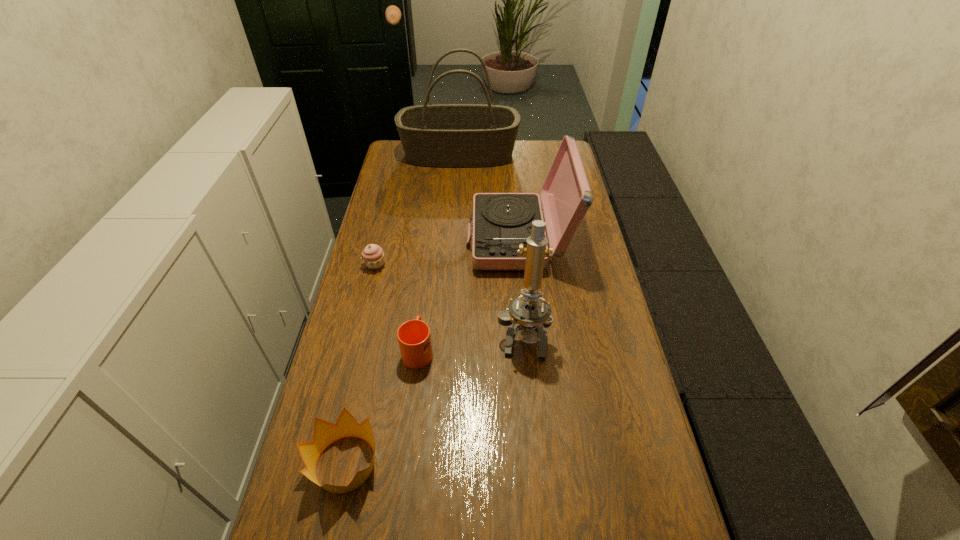
Locate an element on the screen. vacant area situated 0.290m with the lid open on the fourth shortest object is located at coordinates (385, 239).

I want to click on vacant space situated on the handle side of the mug, so click(428, 264).

I want to click on vacant position located 0.230m on the handle side of the mug, so click(x=427, y=276).

Where is `free spot located 0.270m on the handle side of the mug`? free spot located 0.270m on the handle side of the mug is located at coordinates (428, 268).

Find the location of a particular element. The width and height of the screenshot is (960, 540). vacant space situated 0.150m on the back of the nearest object is located at coordinates (365, 375).

The image size is (960, 540). I want to click on free spot located on the back of the shortest object, so click(387, 218).

This screenshot has width=960, height=540. In order to click on object that is at the far edge in this screenshot , I will do `click(441, 135)`.

This screenshot has height=540, width=960. Find the location of `basket present at the left edge`. basket present at the left edge is located at coordinates (441, 135).

You are a GUI agent. You are given a task and a screenshot of the screen. Output one action in this format:
    pyautogui.click(x=<x>, y=<y>)
    Task: Click on the crown positioned at the left edge
    This screenshot has width=960, height=540.
    Given the screenshot: What is the action you would take?
    pyautogui.click(x=325, y=433)

The image size is (960, 540). I want to click on cupcake that is at the left edge, so click(x=373, y=256).